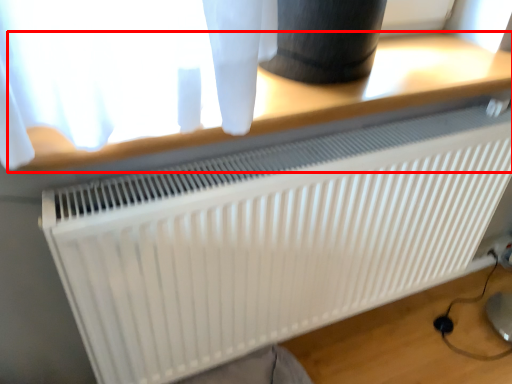
Question: From the image's perspective, what is the correct spatial relationship of table (annotated by the red box) in relation to radiator?

Choices:
 (A) below
 (B) above

Answer: (B)